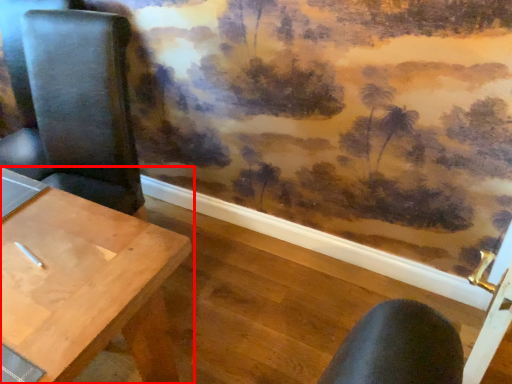
Question: From the image's perspective, where is table (annotated by the red box) located relative to chair?

Choices:
 (A) above
 (B) below

Answer: (B)